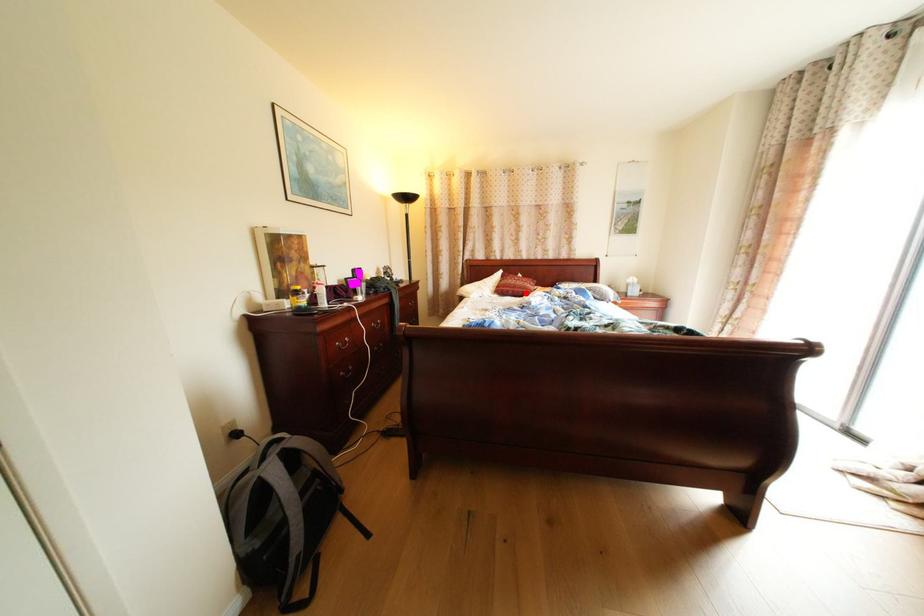
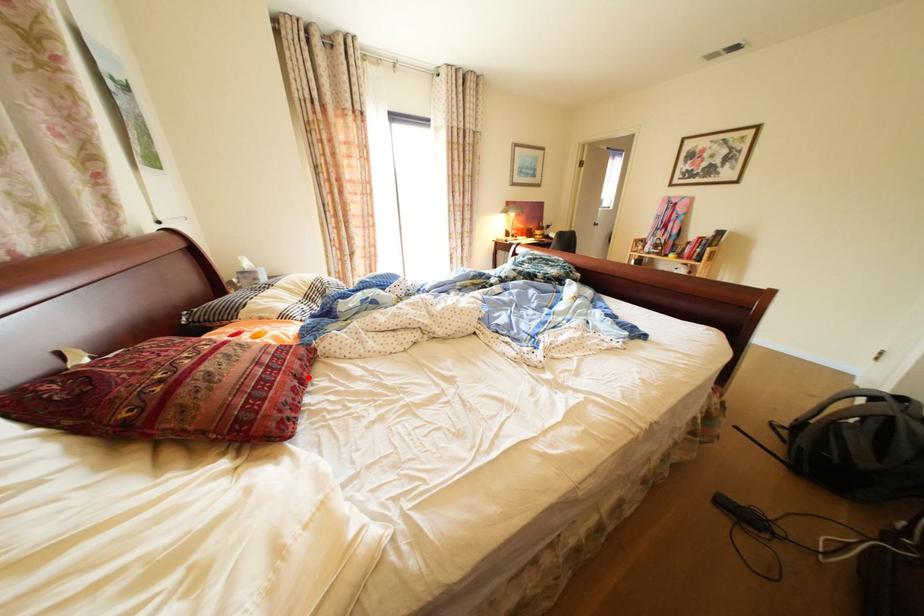
I am providing you with two images of the same scene from different viewpoints. A red point is marked on the first image and another point is marked on the second image. Does the point marked in image1 correspond to the same location as the one in image2?

Yes